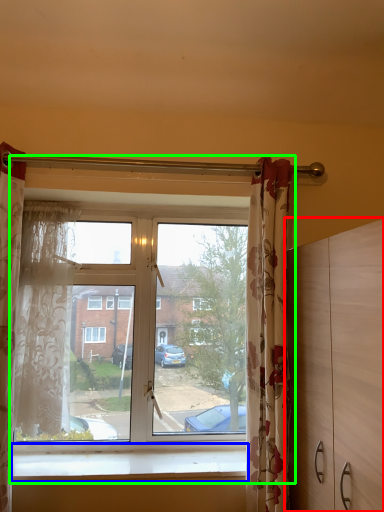
Question: Which is nearer to the dresser (highlighted by a red box)? window sill (highlighted by a blue box) or window (highlighted by a green box).

Choices:
 (A) window sill
 (B) window

Answer: (A)